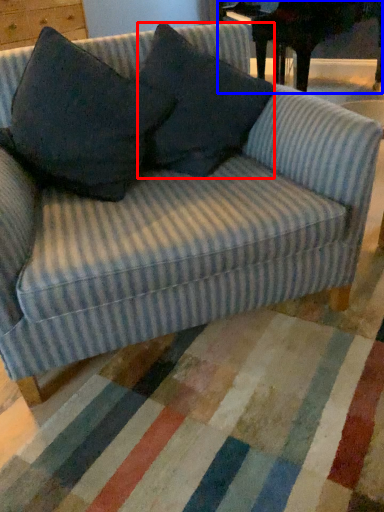
Question: Which of the following is the closest to the observer, throw pillow (highlighted by a red box) or table (highlighted by a blue box)?

Choices:
 (A) throw pillow
 (B) table

Answer: (A)